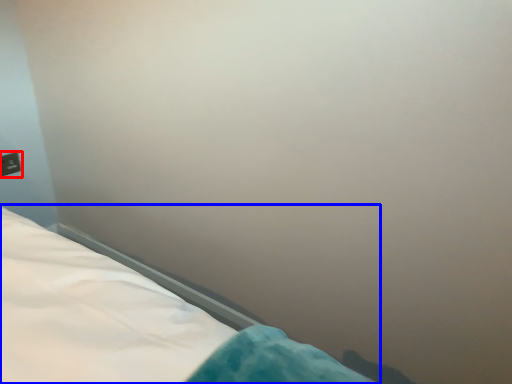
Question: Which object appears farthest to the camera in this image, electric outlet (highlighted by a red box) or bed (highlighted by a blue box)?

Choices:
 (A) electric outlet
 (B) bed

Answer: (A)